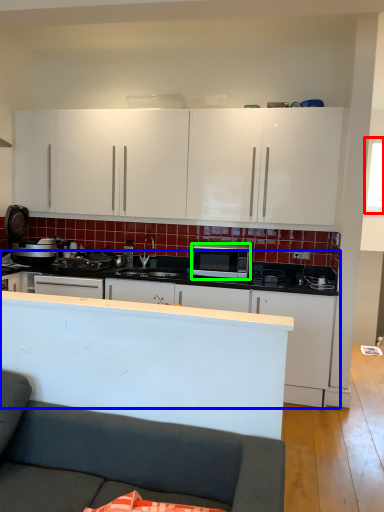
Question: Based on their relative distances, which object is farther from window screen (highlighted by a red box)? Choose from cabinetry (highlighted by a blue box) and microwave oven (highlighted by a green box).

Choices:
 (A) cabinetry
 (B) microwave oven

Answer: (A)